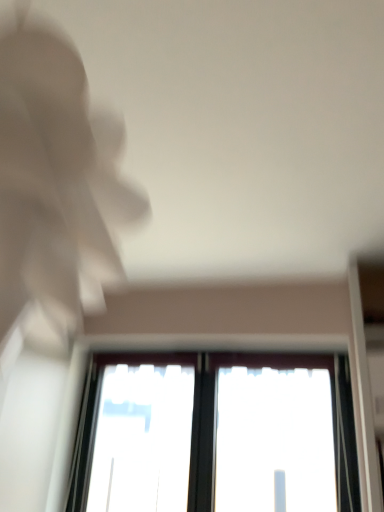
At what (x,y) coordinates should I click in order to perform the action: click on transparent glass window at center. Please return your answer as a coordinate pair (x, y). Looking at the image, I should click on (215, 434).

This screenshot has height=512, width=384. Describe the element at coordinates (215, 434) in the screenshot. I see `transparent glass window at center` at that location.

I want to click on transparent glass window at center, so click(215, 434).